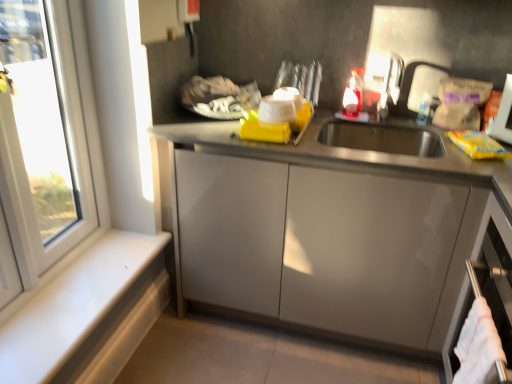
Question: Is white cotton towel at lower right to the left of white matte window sill at lower left from the viewer's perspective?

Choices:
 (A) yes
 (B) no

Answer: (B)

Question: Is white cotton towel at lower right further to camera compared to white matte window sill at lower left?

Choices:
 (A) no
 (B) yes

Answer: (A)

Question: From the image's perspective, would you say white cotton towel at lower right is positioned over white matte window sill at lower left?

Choices:
 (A) no
 (B) yes

Answer: (A)

Question: Can you confirm if white cotton towel at lower right is thinner than white matte window sill at lower left?

Choices:
 (A) yes
 (B) no

Answer: (A)

Question: Can you confirm if white cotton towel at lower right is shorter than white matte window sill at lower left?

Choices:
 (A) yes
 (B) no

Answer: (B)

Question: Is white cotton towel at lower right facing towards white matte window sill at lower left?

Choices:
 (A) yes
 (B) no

Answer: (A)

Question: Can you confirm if white plastic window at left is thinner than yellow matte packet at right?

Choices:
 (A) no
 (B) yes

Answer: (B)

Question: From a real-world perspective, is white plastic window at left beneath yellow matte packet at right?

Choices:
 (A) yes
 (B) no

Answer: (A)

Question: Is the position of white plastic window at left more distant than that of yellow matte packet at right?

Choices:
 (A) yes
 (B) no

Answer: (B)

Question: Is white plastic window at left smaller than yellow matte packet at right?

Choices:
 (A) yes
 (B) no

Answer: (B)

Question: From the image's perspective, is white plastic window at left above yellow matte packet at right?

Choices:
 (A) yes
 (B) no

Answer: (A)

Question: Is white plastic window at left turned away from yellow matte packet at right?

Choices:
 (A) yes
 (B) no

Answer: (B)

Question: Does satin silver dishwasher at lower right have a greater width compared to white cotton towel at lower right?

Choices:
 (A) no
 (B) yes

Answer: (B)